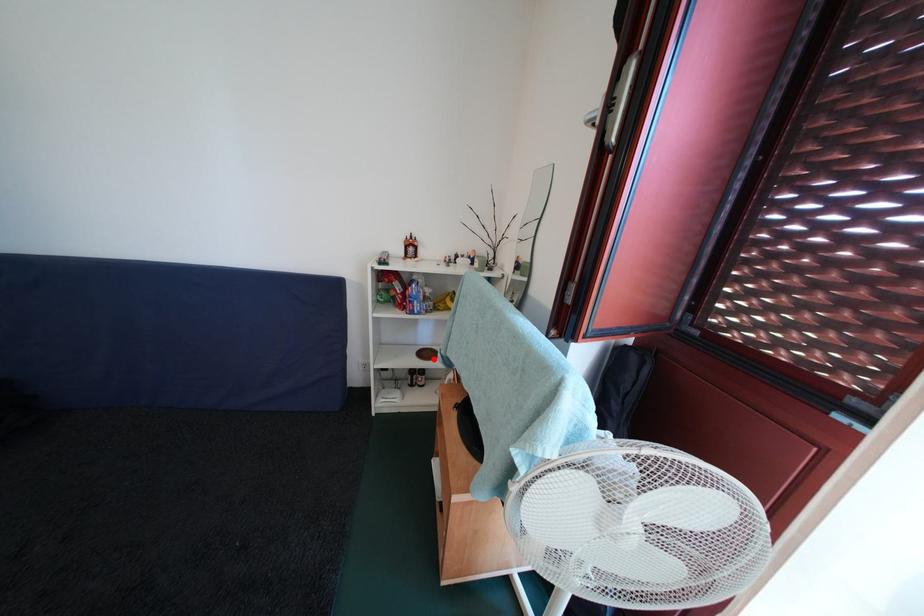
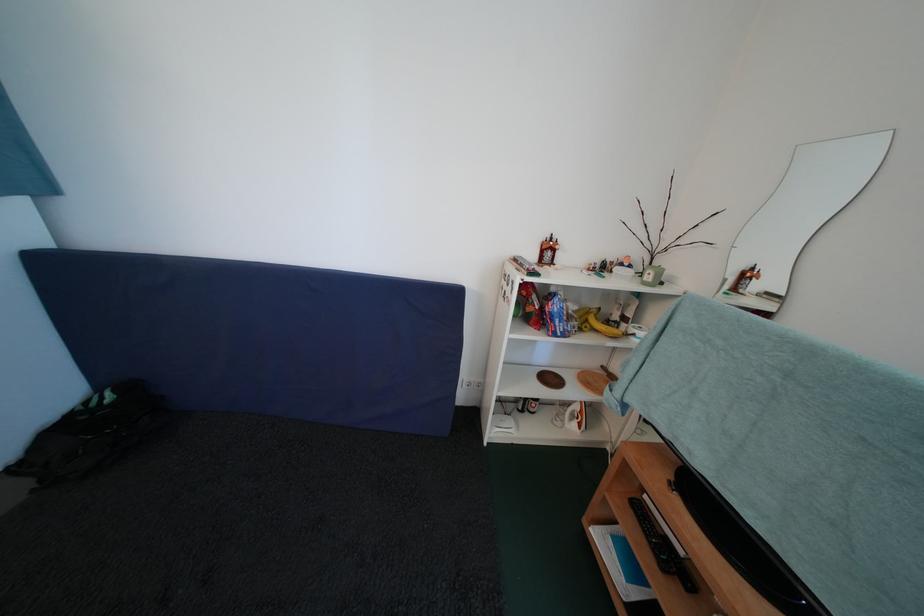
Question: A red point is marked in image1. In image2, is the corresponding 3D point closer to the camera or farther? Reply with the corresponding letter.

Choices:
 (A) The corresponding 3D point is closer.
 (B) The corresponding 3D point is farther.

Answer: (A)